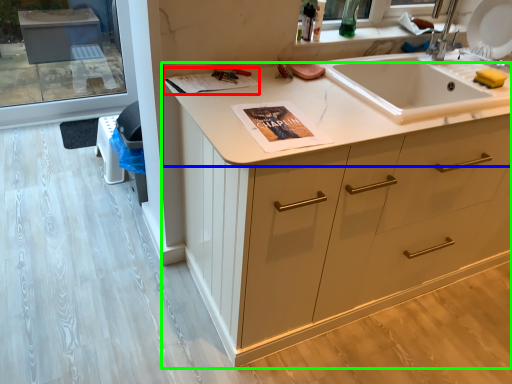
Question: Which is farther away from magazine (highlighted by a red box)? countertop (highlighted by a blue box) or cabinetry (highlighted by a green box)?

Choices:
 (A) countertop
 (B) cabinetry

Answer: (B)